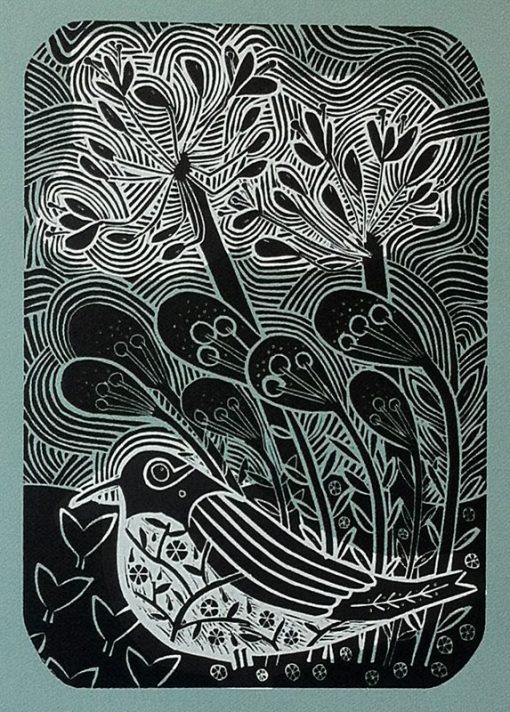
Image resolution: width=510 pixels, height=712 pixels. What are the coordinates of `small little plants` in the screenshot? It's located at (150, 676), (111, 614), (78, 534), (57, 590), (36, 639), (71, 681).